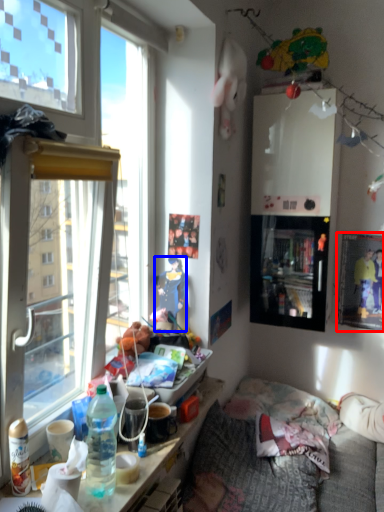
Question: Which object appears closest to the camera in this image, picture frame (highlighted by a red box) or person (highlighted by a blue box)?

Choices:
 (A) picture frame
 (B) person

Answer: (B)